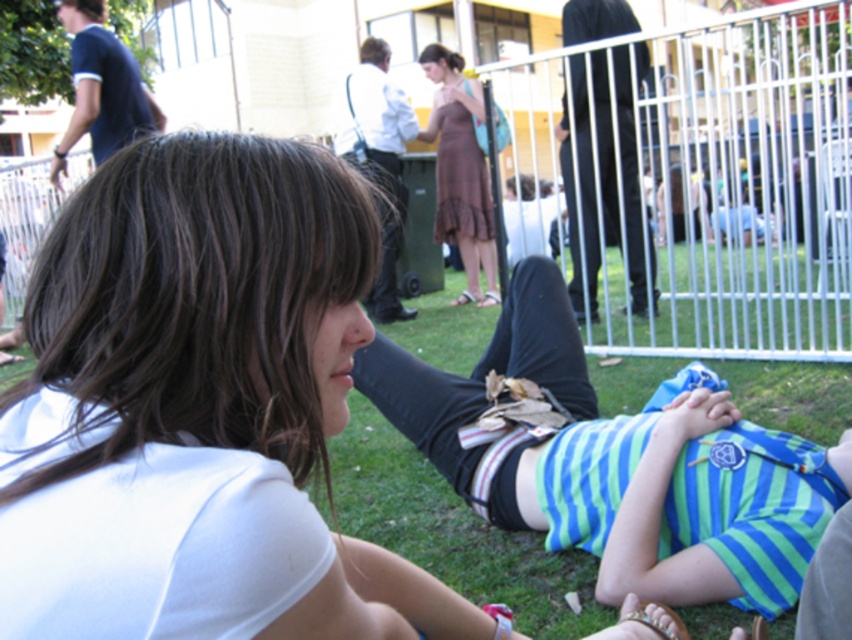
Can you confirm if white matte shirt at center is shorter than brown dress at center?

Indeed, white matte shirt at center has a lesser height compared to brown dress at center.

Which is in front, point (114, 432) or point (471, 227)?

Positioned in front is point (114, 432).

Is point (157, 561) farther from camera compared to point (452, 225)?

No, (157, 561) is closer to viewer.

Where is `white matte shirt at center`? This screenshot has height=640, width=852. white matte shirt at center is located at coordinates (200, 403).